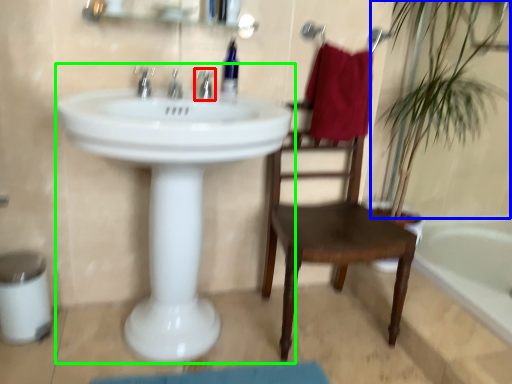
Question: Estimate the real-world distances between objects in this image. Which object is closer to tap (highlighted by a red box), vegetation (highlighted by a blue box) or sink (highlighted by a green box)?

Choices:
 (A) vegetation
 (B) sink

Answer: (B)